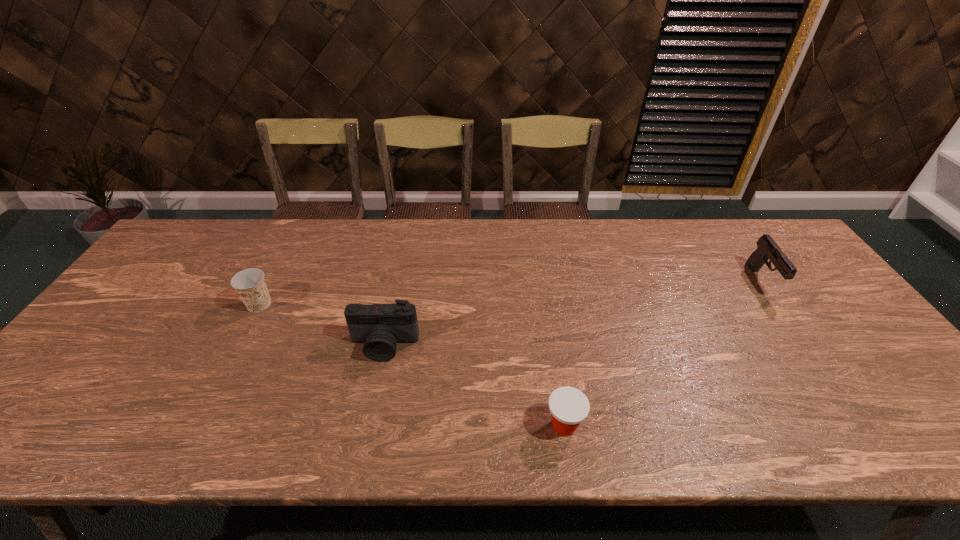
The height and width of the screenshot is (540, 960). What are the coordinates of `vacant area between the right Dixie cup and the second nearest object` in the screenshot? It's located at [474, 386].

Image resolution: width=960 pixels, height=540 pixels. I want to click on vacant space that is in between the rightmost object and the second nearest object, so click(x=573, y=313).

What are the coordinates of `vacant area that lies between the second nearest object and the left Dixie cup` in the screenshot? It's located at (322, 325).

The image size is (960, 540). Identify the location of free spot between the rightmost object and the farther Dixie cup. pyautogui.click(x=511, y=293).

Locate an element on the screen. The height and width of the screenshot is (540, 960). free spot between the third object from right to left and the leftmost object is located at coordinates (322, 325).

This screenshot has height=540, width=960. I want to click on vacant space in between the right Dixie cup and the farther Dixie cup, so click(412, 365).

What are the coordinates of `vacant area that lies between the rightmost object and the leftmost object` in the screenshot? It's located at (511, 293).

Identify the location of empty location between the rightmost object and the left Dixie cup. The image size is (960, 540). (511, 293).

Where is `free space between the left Dixie cup and the right Dixie cup`? This screenshot has height=540, width=960. free space between the left Dixie cup and the right Dixie cup is located at coordinates (412, 365).

Point out which object is positioned as the nearest to the third farthest object. Please provide its 2D coordinates. Your answer should be formatted as a tuple, i.e. [(x, y)], where the tuple contains the x and y coordinates of a point satisfying the conditions above.

[(250, 285)]